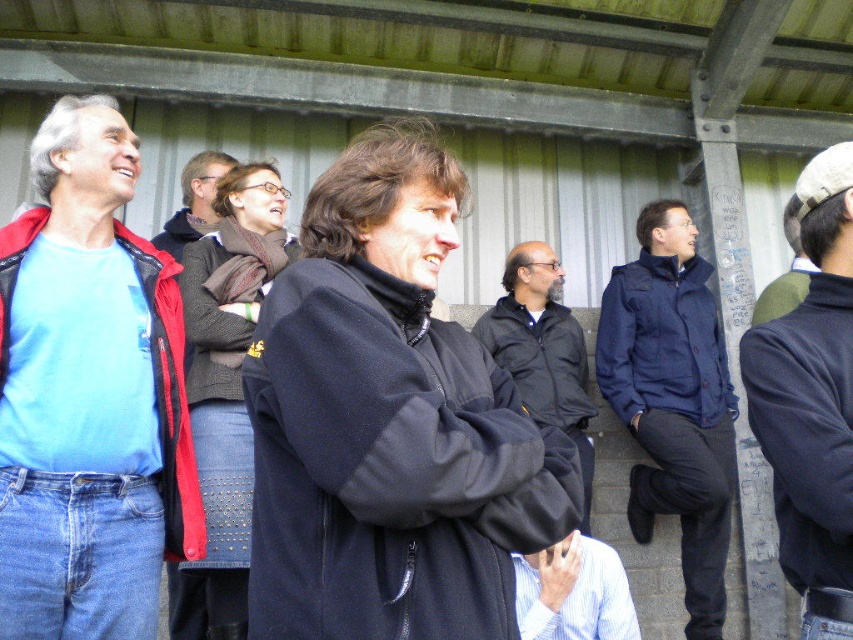
Question: Can you confirm if dark blue sweater at center is positioned to the left of knitted wool scarf at upper center?

Choices:
 (A) yes
 (B) no

Answer: (B)

Question: Does navy blue jacket at center appear over knitted wool sweater at center?

Choices:
 (A) no
 (B) yes

Answer: (A)

Question: Among these objects, which one is nearest to the camera?

Choices:
 (A) green fuzzy hat at upper right
 (B) black matte jacket at center
 (C) matte black jacket at center

Answer: (A)

Question: Does dark blue sweater at center lie behind knitted wool sweater at center?

Choices:
 (A) yes
 (B) no

Answer: (B)

Question: Estimate the real-world distances between objects in this image. Which object is closer to the black fleece jacket at center?

Choices:
 (A) matte black jacket at center
 (B) dark gray fleece jacket at center
 (C) knitted wool sweater at center

Answer: (C)

Question: Which point is closer to the camera?

Choices:
 (A) matte black jacket at left
 (B) black fleece jacket at center

Answer: (B)